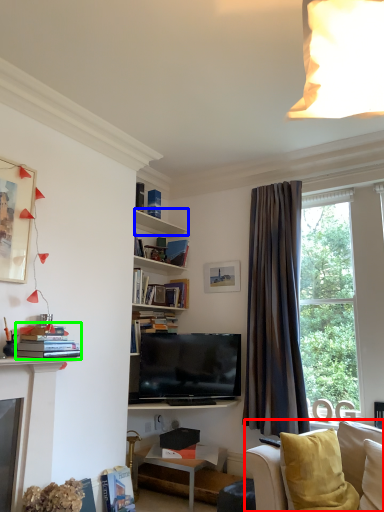
Question: Which is farther away from studio couch (highlighted by a red box)? shelf (highlighted by a blue box) or book (highlighted by a green box)?

Choices:
 (A) shelf
 (B) book

Answer: (A)